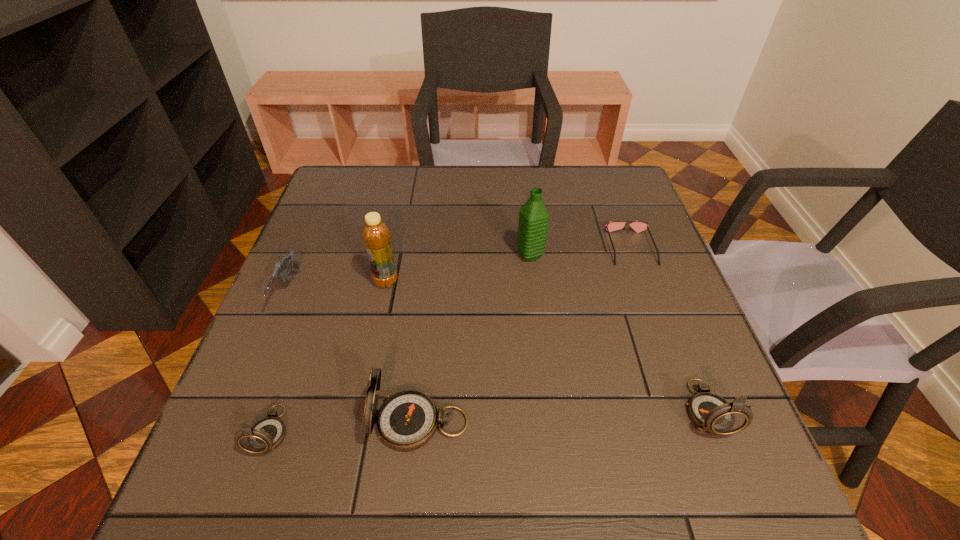
Please mark a free spot for a new compass to balance the arrangement. Please provide its 2D coordinates. Your answer should be formatted as a tuple, i.e. [(x, y)], where the tuple contains the x and y coordinates of a point satisfying the conditions above.

[(564, 416)]